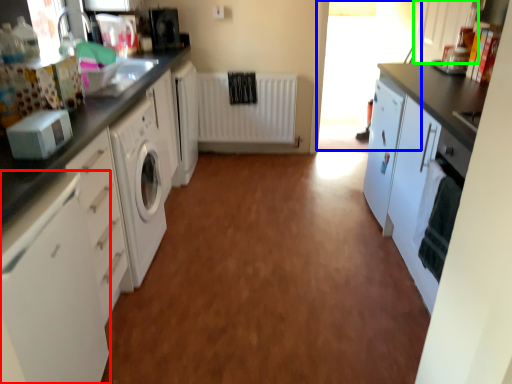
Question: Which is farther away from cabinetry (highlighted by a red box)? window screen (highlighted by a blue box) or cabinetry (highlighted by a green box)?

Choices:
 (A) window screen
 (B) cabinetry

Answer: (A)